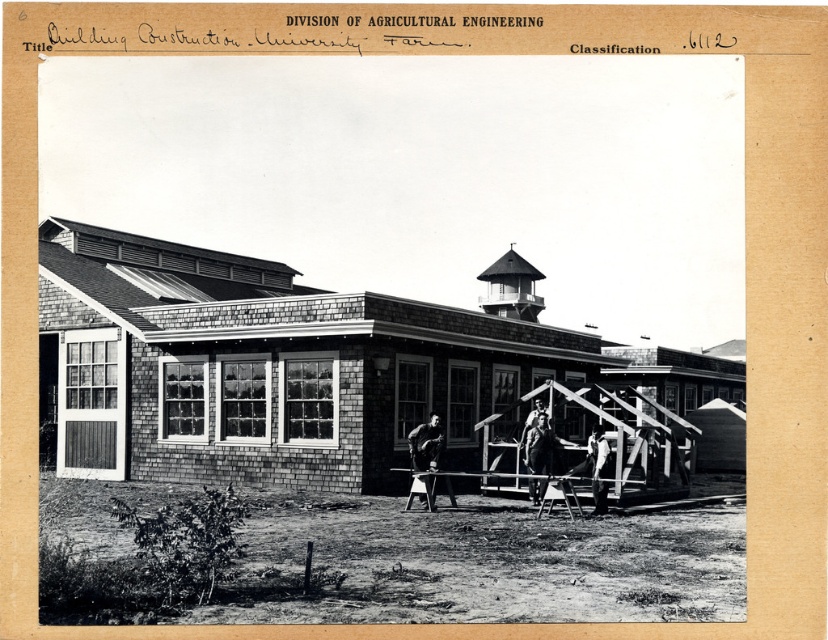
Is smooth wooden frame at center thinner than metallic silver ladder at center?

Indeed, smooth wooden frame at center has a lesser width compared to metallic silver ladder at center.

The width and height of the screenshot is (828, 640). What do you see at coordinates (538, 445) in the screenshot?
I see `smooth wooden frame at center` at bounding box center [538, 445].

Does point (533, 429) lie in front of point (570, 483)?

No, it is behind (570, 483).

Find the location of a particular element. Image resolution: width=828 pixels, height=640 pixels. smooth wooden frame at center is located at coordinates (538, 445).

Is point (542, 426) closer to viewer compared to point (431, 467)?

That is False.

The width and height of the screenshot is (828, 640). Describe the element at coordinates (538, 445) in the screenshot. I see `smooth wooden frame at center` at that location.

At what (x,y) coordinates should I click in order to perform the action: click on smooth wooden frame at center. Please return your answer as a coordinate pair (x, y). Image resolution: width=828 pixels, height=640 pixels. Looking at the image, I should click on (538, 445).

Does smooth wooden frame at center have a lesser height compared to wooden ladder at center?

Answer: Yes.

At what (x,y) coordinates should I click in order to perform the action: click on smooth wooden frame at center. Please return your answer as a coordinate pair (x, y). The height and width of the screenshot is (640, 828). Looking at the image, I should click on (538, 445).

The height and width of the screenshot is (640, 828). What are the coordinates of `smooth wooden frame at center` in the screenshot? It's located at (538, 445).